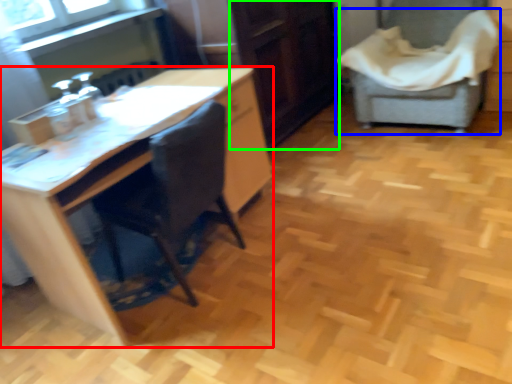
Question: Which is farther away from desk (highlighted by a red box)? chair (highlighted by a blue box) or file cabinet (highlighted by a green box)?

Choices:
 (A) chair
 (B) file cabinet

Answer: (A)